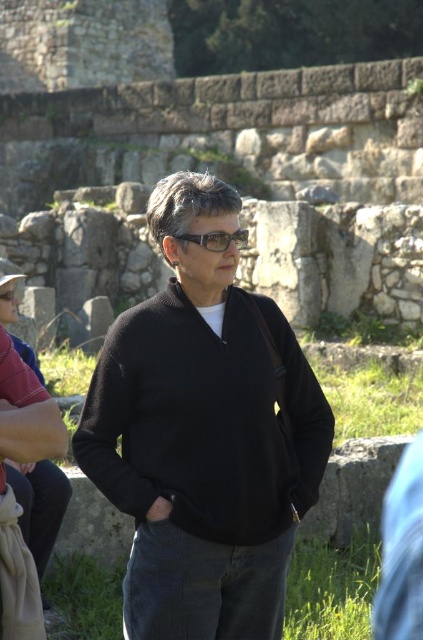
You are a photographer trying to capture the person in the scene. You want to focus on the transparent plastic glasses at center without including the black knitted sweater at center in the frame. Based on their positions, which direction should you move your camera to achieve this?

Since the black knitted sweater at center is to the left of transparent plastic glasses at center, you should move your camera to the right to exclude the sweater while keeping the glasses in view.

You are a fashion designer observing the person in the ancient stone structure. You need to determine if the transparent plastic glasses at center can be stored inside the black knitted sweater at center without damaging them. Based on the size comparison provided, what is your conclusion?

The black knitted sweater at center is bigger than the transparent plastic glasses at center, so the glasses can be stored inside the sweater without damage.

You are a fashion designer observing the person in the ancient stone structure. You need to determine if the transparent plastic glasses at center can be placed inside the black knitted sweater at center without any modifications. Based on their sizes, what do you conclude?

The black knitted sweater at center has a larger width than the transparent plastic glasses at center, so the glasses can fit inside the sweater without needing any modifications.